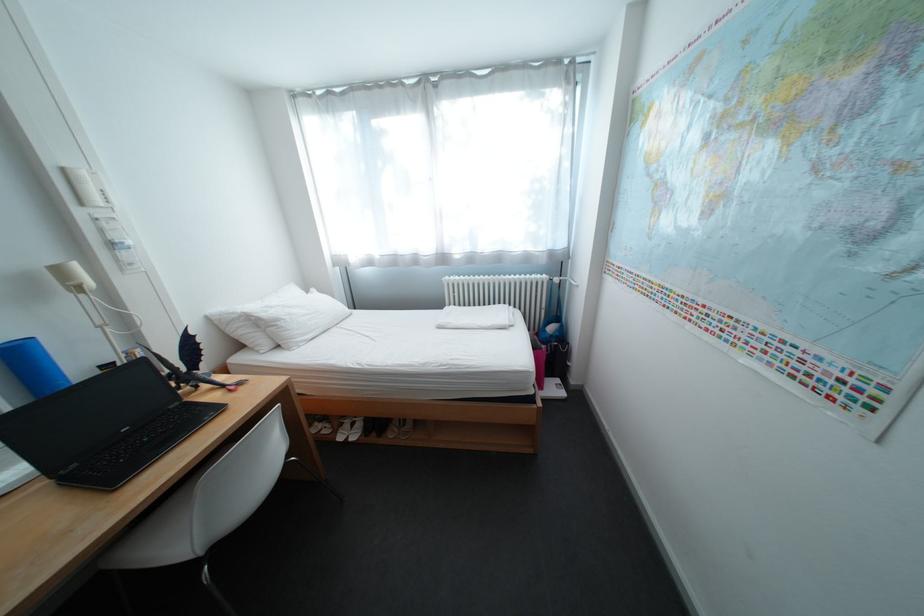
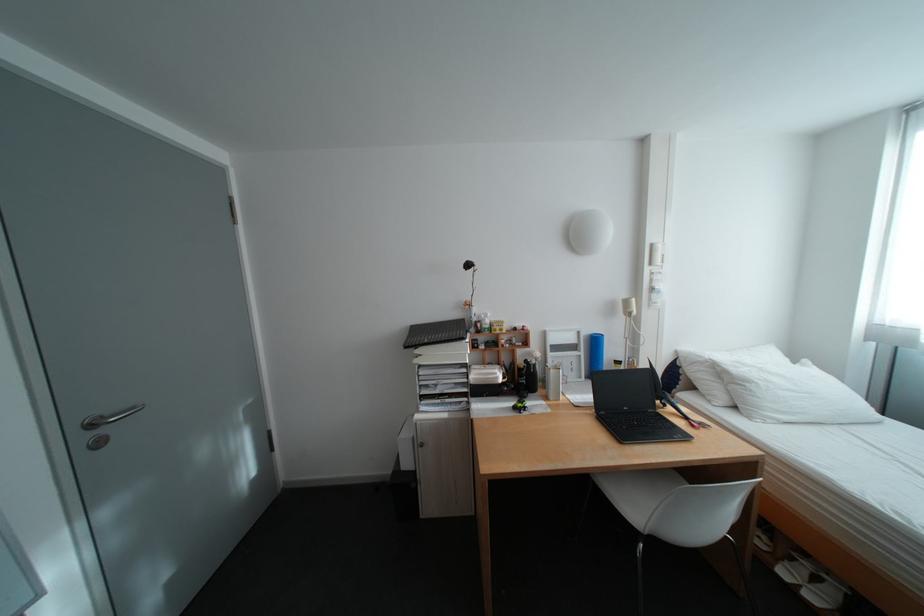
Where in the second image is the point corresponding to point (360, 438) from the first image?

(813, 586)